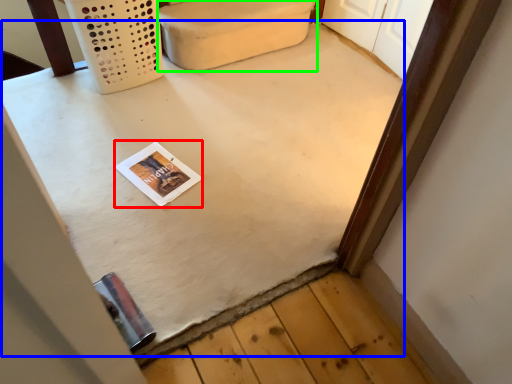
Question: Estimate the real-world distances between objects in this image. Which object is farther from magazine (highlighted by a red box), table (highlighted by a blue box) or furniture (highlighted by a green box)?

Choices:
 (A) table
 (B) furniture

Answer: (B)